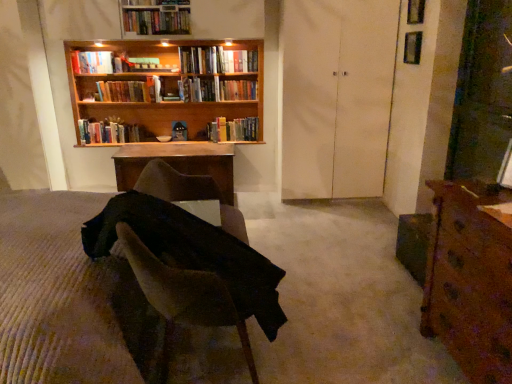
Where is `free space above hardcover books at center, which is counted as the fifth book, starting from the top (from a real-world perspective)`? This screenshot has width=512, height=384. free space above hardcover books at center, which is counted as the fifth book, starting from the top (from a real-world perspective) is located at coordinates (x=218, y=78).